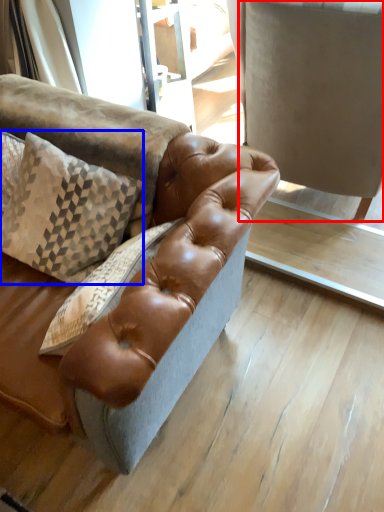
Question: Among these objects, which one is nearest to the camera, swivel chair (highlighted by a red box) or pillow (highlighted by a blue box)?

Choices:
 (A) swivel chair
 (B) pillow

Answer: (B)